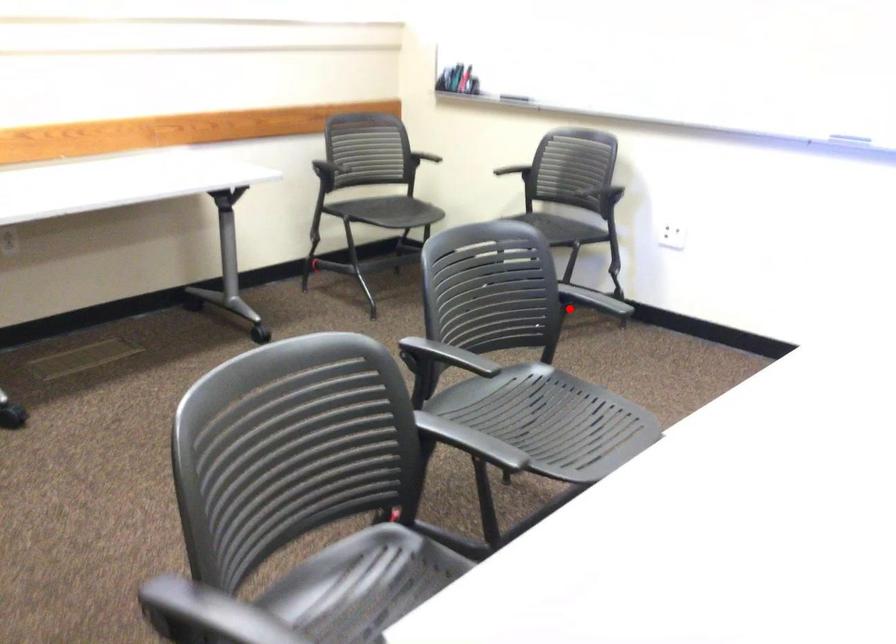
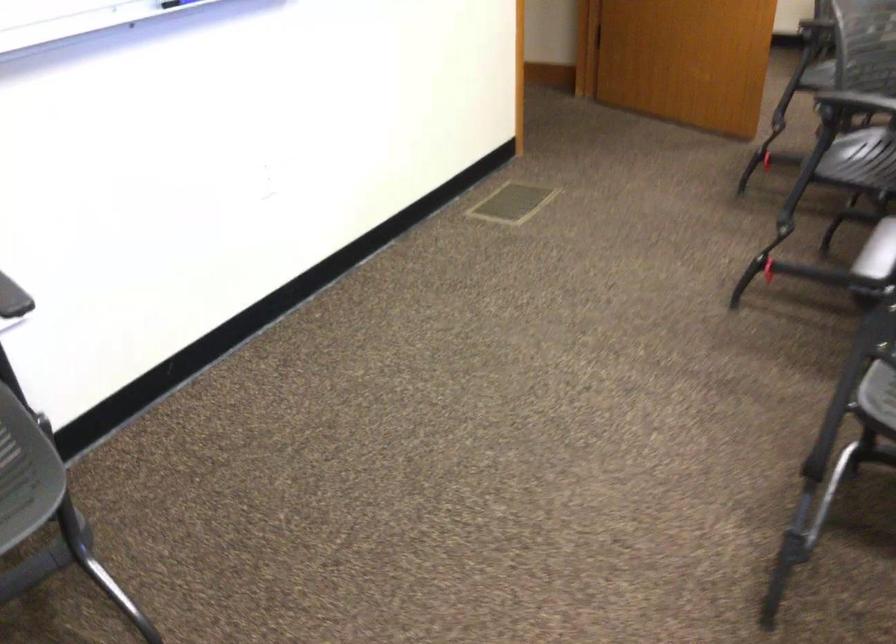
Question: I am providing you with two images of the same scene from different viewpoints. Given a red point in image1, look at the same physical point in image2. Is it:

Choices:
 (A) Closer to the viewpoint
 (B) Farther from the viewpoint

Answer: (A)